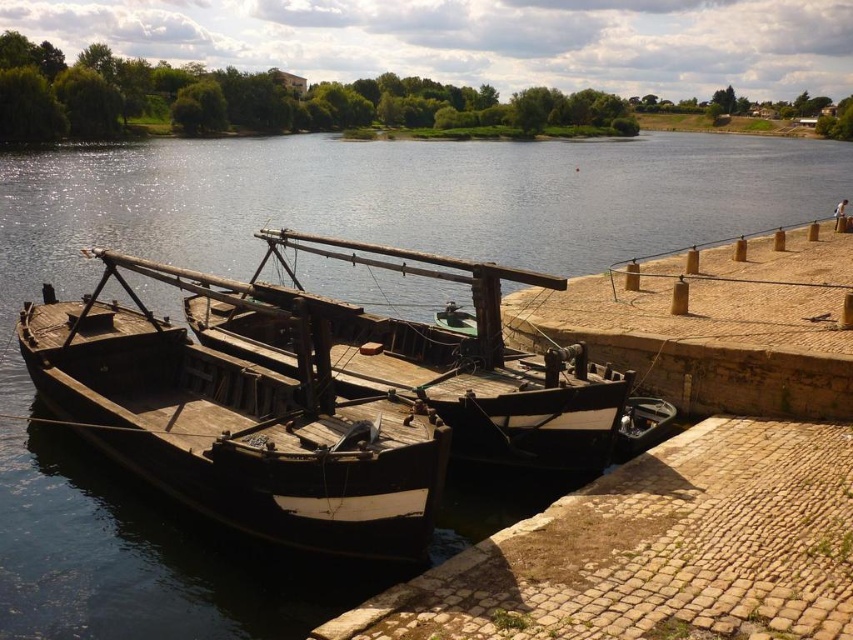
Can you confirm if wooden boat at left is positioned above wooden boat at center?

No.

Does point (114, 305) come farther from viewer compared to point (233, 346)?

Yes, it is behind point (233, 346).

The image size is (853, 640). What do you see at coordinates (239, 420) in the screenshot? I see `wooden boat at left` at bounding box center [239, 420].

The width and height of the screenshot is (853, 640). Find the location of `wooden boat at left`. wooden boat at left is located at coordinates (239, 420).

Who is taller, wooden boat at left or brown stone dock at right?

brown stone dock at right

Does wooden boat at left appear on the right side of brown stone dock at right?

In fact, wooden boat at left is to the left of brown stone dock at right.

This screenshot has height=640, width=853. What do you see at coordinates (239, 420) in the screenshot?
I see `wooden boat at left` at bounding box center [239, 420].

Find the location of a particular element. The width and height of the screenshot is (853, 640). wooden boat at left is located at coordinates (239, 420).

Which is below, wooden boat at center or brown stone dock at right?

wooden boat at center is lower down.

Who is positioned more to the left, wooden boat at center or brown stone dock at right?

From the viewer's perspective, wooden boat at center appears more on the left side.

Who is more distant from viewer, (x=364, y=248) or (x=683, y=259)?

The point (x=683, y=259) is behind.

The width and height of the screenshot is (853, 640). I want to click on wooden boat at center, so click(434, 358).